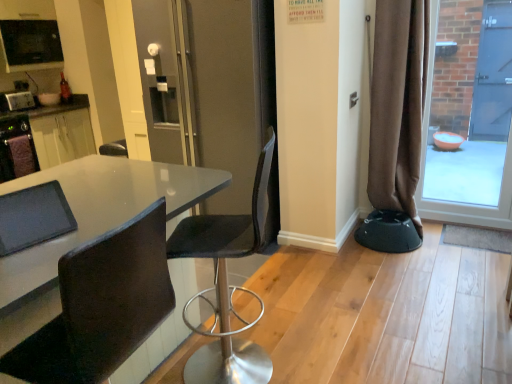
The image size is (512, 384). Identify the location of black mesh chair at center, which appears as the second chair when viewed from the front. (227, 284).

What are the coordinates of `brown fabric curtain at right` in the screenshot? It's located at click(x=398, y=104).

The width and height of the screenshot is (512, 384). Describe the element at coordinates (44, 137) in the screenshot. I see `matte black table at left` at that location.

The image size is (512, 384). Identify the location of black plastic bar stool at lower right. (388, 232).

The width and height of the screenshot is (512, 384). Describe the element at coordinates (203, 89) in the screenshot. I see `matte black screen door at center` at that location.

You are a GUI agent. You are given a task and a screenshot of the screen. Output one action in this format:
    pyautogui.click(x=<x>, y=<y>)
    Task: Click on the black leather chair at lower left, the second chair viewed from the back
    The width and height of the screenshot is (512, 384).
    Given the screenshot: What is the action you would take?
    pyautogui.click(x=101, y=306)

Find the location of a particular element. This screenshot has height=384, width=512. transparent glass door at right is located at coordinates (460, 203).

Is black leather chair at lower left, arranged as the first chair when viewed from the front, far away from black mesh chair at center, positioned as the first chair in back-to-front order?

Actually, black leather chair at lower left, arranged as the first chair when viewed from the front, and black mesh chair at center, positioned as the first chair in back-to-front order, are a little close together.

From the image's perspective, which is above, black leather chair at lower left, arranged as the first chair when viewed from the front, or black mesh chair at center, which appears as the second chair when viewed from the front?

black mesh chair at center, which appears as the second chair when viewed from the front, from the image's perspective.

Considering the points (87, 300) and (218, 269), which point is behind, point (87, 300) or point (218, 269)?

Positioned behind is point (218, 269).

From the picture: From the image's perspective, which one is positioned higher, glossy white table at center or black glossy microwave at upper left, arranged as the 1th appliance when viewed from the top?

From the image's view, black glossy microwave at upper left, arranged as the 1th appliance when viewed from the top, is above.

Is glossy white table at center positioned before black glossy microwave at upper left, arranged as the 1th appliance when viewed from the top?

Yes, glossy white table at center is in front of black glossy microwave at upper left, arranged as the 1th appliance when viewed from the top.

How much distance is there between glossy white table at center and black glossy microwave at upper left, acting as the 2th appliance starting from the bottom?

glossy white table at center and black glossy microwave at upper left, acting as the 2th appliance starting from the bottom, are 2.67 meters apart.

Does glossy white table at center have a lesser height compared to black glossy microwave at upper left, arranged as the 1th appliance when viewed from the top?

Incorrect, the height of glossy white table at center does not fall short of that of black glossy microwave at upper left, arranged as the 1th appliance when viewed from the top.

Is brushed metal toaster at left, which is the 1th appliance from bottom to top, situated inside black leather chair at lower left, the second chair viewed from the back, or outside?

brushed metal toaster at left, which is the 1th appliance from bottom to top, is spatially situated outside black leather chair at lower left, the second chair viewed from the back.

Is black leather chair at lower left, arranged as the first chair when viewed from the front, at the back of brushed metal toaster at left, positioned as the 2th appliance in top-to-bottom order?

No, brushed metal toaster at left, positioned as the 2th appliance in top-to-bottom order, is not facing away from black leather chair at lower left, arranged as the first chair when viewed from the front.

Is brushed metal toaster at left, positioned as the 2th appliance in top-to-bottom order, touching black leather chair at lower left, the second chair viewed from the back?

No, brushed metal toaster at left, positioned as the 2th appliance in top-to-bottom order, is not touching black leather chair at lower left, the second chair viewed from the back.

Is black leather chair at lower left, arranged as the first chair when viewed from the front, to the left or to the right of matte black table at left in the image?

From the image, it's evident that black leather chair at lower left, arranged as the first chair when viewed from the front, is to the right of matte black table at left.

From a real-world perspective, is black leather chair at lower left, arranged as the first chair when viewed from the front, physically located above or below matte black table at left?

From a real-world perspective, black leather chair at lower left, arranged as the first chair when viewed from the front, is physically above matte black table at left.

Which object is closer to the camera, black leather chair at lower left, the second chair viewed from the back, or matte black table at left?

black leather chair at lower left, the second chair viewed from the back, is more forward.

Considering the relative sizes of matte black screen door at center and black mesh chair at center, positioned as the first chair in back-to-front order, in the image provided, is matte black screen door at center bigger than black mesh chair at center, positioned as the first chair in back-to-front order,?

Yes, matte black screen door at center is bigger than black mesh chair at center, positioned as the first chair in back-to-front order.

Can you tell me how much matte black screen door at center and black mesh chair at center, positioned as the first chair in back-to-front order, differ in facing direction?

matte black screen door at center and black mesh chair at center, positioned as the first chair in back-to-front order, are facing 86.1 degrees away from each other.

Is matte black screen door at center facing towards black mesh chair at center, which appears as the second chair when viewed from the front?

No, matte black screen door at center does not turn towards black mesh chair at center, which appears as the second chair when viewed from the front.

Which is closer, (190, 114) or (227, 223)?

Point (227, 223)

Is matte black table at left closer to camera compared to brushed metal toaster at left, which is the 1th appliance from bottom to top?

Yes, matte black table at left is closer to the viewer.

Does matte black table at left turn towards brushed metal toaster at left, which is the 1th appliance from bottom to top?

No, matte black table at left is not turned towards brushed metal toaster at left, which is the 1th appliance from bottom to top.

In the scene shown: Is matte black table at left taller or shorter than brushed metal toaster at left, which is the 1th appliance from bottom to top?

Clearly, matte black table at left is taller compared to brushed metal toaster at left, which is the 1th appliance from bottom to top.

From a real-world perspective, is matte black table at left located higher than brushed metal toaster at left, positioned as the 2th appliance in top-to-bottom order?

No, from a real-world perspective, matte black table at left is not over brushed metal toaster at left, positioned as the 2th appliance in top-to-bottom order

Is there a large distance between black glossy microwave at upper left, arranged as the 1th appliance when viewed from the top, and matte black screen door at center?

That's right, there is a large distance between black glossy microwave at upper left, arranged as the 1th appliance when viewed from the top, and matte black screen door at center.

Does black glossy microwave at upper left, acting as the 2th appliance starting from the bottom, appear on the right side of matte black screen door at center?

No.

From a real-world perspective, is black glossy microwave at upper left, acting as the 2th appliance starting from the bottom, physically above matte black screen door at center?

Correct, in the physical world, black glossy microwave at upper left, acting as the 2th appliance starting from the bottom, is higher than matte black screen door at center.

Is point (26, 66) farther from viewer compared to point (200, 207)?

Yes, it is behind point (200, 207).

There is a black mesh chair at center, which appears as the second chair when viewed from the front. Where is `chair above it (from a real-world perspective)`? chair above it (from a real-world perspective) is located at coordinates (101, 306).

Where is `the 1st appliance counting from the left of the glossy white table at center`? Image resolution: width=512 pixels, height=384 pixels. the 1st appliance counting from the left of the glossy white table at center is located at coordinates (31, 45).

When comparing their distances from black glossy microwave at upper left, arranged as the 1th appliance when viewed from the top, does black leather chair at lower left, the second chair viewed from the back, or black mesh chair at center, which appears as the second chair when viewed from the front, seem further?

Among the two, black leather chair at lower left, the second chair viewed from the back, is located further to black glossy microwave at upper left, arranged as the 1th appliance when viewed from the top.

Estimate the real-world distances between objects in this image. Which object is further from matte black screen door at center, transparent glass door at right or black mesh chair at center, which appears as the second chair when viewed from the front?

transparent glass door at right is positioned further to the anchor matte black screen door at center.

Based on their spatial positions, is matte black table at left or brown fabric curtain at right closer to brushed metal toaster at left, positioned as the 2th appliance in top-to-bottom order?

matte black table at left is positioned closer to the anchor brushed metal toaster at left, positioned as the 2th appliance in top-to-bottom order.

In the scene shown: Based on their spatial positions, is brown fabric curtain at right or transparent glass door at right further from glossy white table at center?

transparent glass door at right lies further to glossy white table at center than the other object.

Considering their positions, is transparent glass door at right positioned closer to black leather chair at lower left, the second chair viewed from the back, than brown fabric curtain at right?

Among the two, brown fabric curtain at right is located nearer to black leather chair at lower left, the second chair viewed from the back.

From the image, which object appears to be farther from glossy white table at center, transparent glass door at right or black mesh chair at center, which appears as the second chair when viewed from the front?

The object further to glossy white table at center is transparent glass door at right.

When comparing their distances from black leather chair at lower left, arranged as the first chair when viewed from the front, does glossy white table at center or matte black screen door at center seem further?

Based on the image, matte black screen door at center appears to be further to black leather chair at lower left, arranged as the first chair when viewed from the front.

Which object lies further to the anchor point matte black screen door at center, matte black table at left or glossy white table at center?

matte black table at left is further to matte black screen door at center.

Where is `screen door between black leather chair at lower left, arranged as the first chair when viewed from the front, and matte black table at left, along the z-axis`? The width and height of the screenshot is (512, 384). screen door between black leather chair at lower left, arranged as the first chair when viewed from the front, and matte black table at left, along the z-axis is located at coordinates (203, 89).

Find the location of a particular element. The height and width of the screenshot is (384, 512). chair between glossy white table at center and black mesh chair at center, which appears as the second chair when viewed from the front is located at coordinates (101, 306).

The image size is (512, 384). Find the location of `appliance situated between brushed metal toaster at left, which is the 1th appliance from bottom to top, and brown fabric curtain at right from left to right`. appliance situated between brushed metal toaster at left, which is the 1th appliance from bottom to top, and brown fabric curtain at right from left to right is located at coordinates (31, 45).

This screenshot has width=512, height=384. What are the coordinates of `curtain between black leather chair at lower left, arranged as the first chair when viewed from the front, and transparent glass door at right, in the horizontal direction` in the screenshot? It's located at (398, 104).